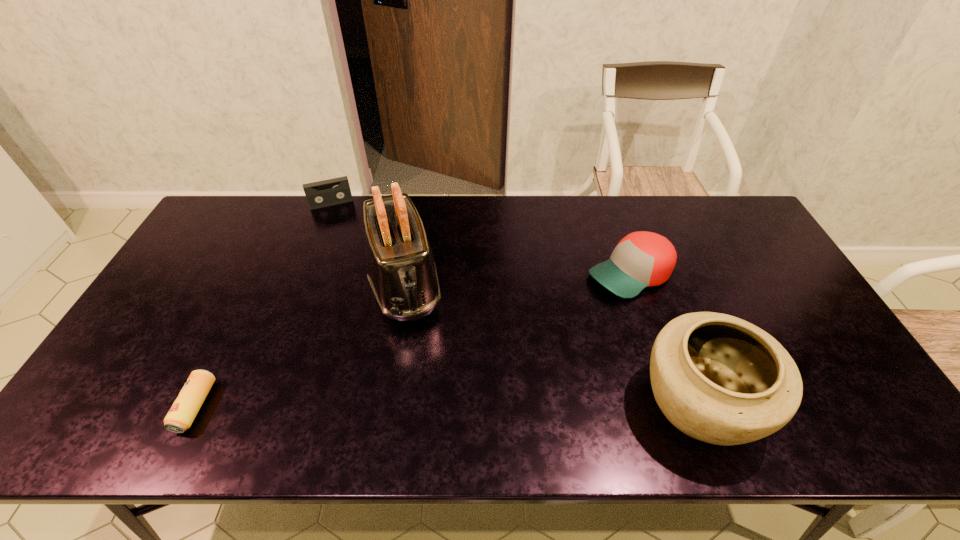
At what (x,y) coordinates should I click in order to perform the action: click on free space on the desktop that is between the shortest object and the fourth shortest object and is positioned on the front-facing side of the videotape. Please return your answer as a coordinate pair (x, y). This screenshot has height=540, width=960. Looking at the image, I should click on (378, 405).

Find the location of a particular element. vacant space on the desktop that is between the leftmost object and the pottery and is positioned on the side of the tallest object with the control lever is located at coordinates (440, 404).

Find the location of a particular element. vacant space on the desktop that is between the beer can and the pottery and is positioned at the brim of the third tallest object is located at coordinates (405, 405).